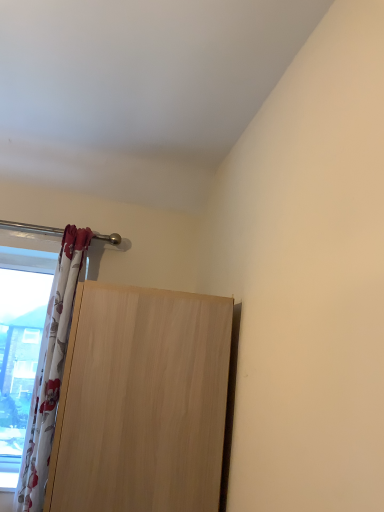
Question: Considering the positions of white floral fabric curtain at left and light wood door at lower left in the image, is white floral fabric curtain at left wider or thinner than light wood door at lower left?

Choices:
 (A) wide
 (B) thin

Answer: (B)

Question: From the image's perspective, is white floral fabric curtain at left above or below light wood door at lower left?

Choices:
 (A) below
 (B) above

Answer: (B)

Question: Would you say white floral fabric curtain at left is inside or outside light wood door at lower left?

Choices:
 (A) inside
 (B) outside

Answer: (B)

Question: Is light wood door at lower left inside the boundaries of white floral fabric curtain at left, or outside?

Choices:
 (A) outside
 (B) inside

Answer: (A)

Question: From a real-world perspective, relative to white floral fabric curtain at left, is light wood door at lower left vertically above or below?

Choices:
 (A) above
 (B) below

Answer: (B)

Question: In terms of size, does light wood door at lower left appear bigger or smaller than white floral fabric curtain at left?

Choices:
 (A) big
 (B) small

Answer: (A)

Question: Considering the positions of light wood door at lower left and white floral fabric curtain at left in the image, is light wood door at lower left wider or thinner than white floral fabric curtain at left?

Choices:
 (A) thin
 (B) wide

Answer: (B)